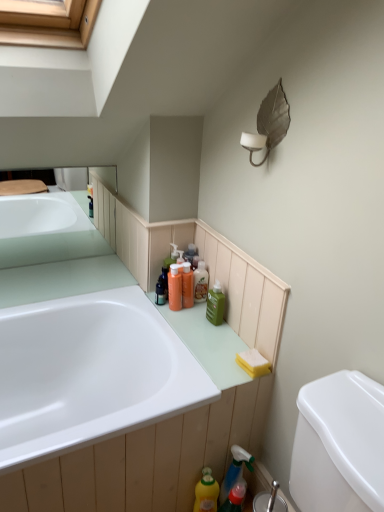
Question: In the image, is metallic leaf-shaped light fixture at upper right on the left side or the right side of translucent plastic spray bottle at lower center, the 2th cleaning product ordered from the bottom?

Choices:
 (A) left
 (B) right

Answer: (B)

Question: Would you say metallic leaf-shaped light fixture at upper right is inside or outside translucent plastic spray bottle at lower center, the 2th cleaning product ordered from the bottom?

Choices:
 (A) inside
 (B) outside

Answer: (B)

Question: Estimate the real-world distances between objects in this image. Which object is closer to the translucent plastic spray bottle at lower center, the 2th cleaning product ordered from the bottom?

Choices:
 (A) white glossy bathtub at lower left
 (B) yellow sponge at lower right
 (C) green matte bottle at upper right, placed as the 1th cleaning product when sorted from top to bottom
 (D) orange plastic bottles at center, which is the first toiletry from left to right
 (E) yellow matte bottle at lower center, which is counted as the 1th cleaning product, starting from the bottom

Answer: (E)

Question: Estimate the real-world distances between objects in this image. Which object is closer to the translucent plastic spray bottle at lower center, positioned as the second cleaning product in top-to-bottom order?

Choices:
 (A) translucent orange bottle at center, which is the 2th toiletry from left to right
 (B) orange plastic bottles at center, which is the first toiletry from left to right
 (C) yellow matte bottle at lower center, the third cleaning product viewed from the top
 (D) yellow sponge at lower right
 (E) green matte bottle at upper right, the third cleaning product ordered from the bottom

Answer: (C)